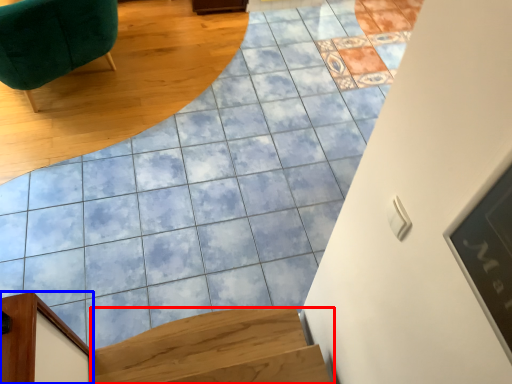
Question: Which object is closer to the camera taking this photo, stairs (highlighted by a red box) or furniture (highlighted by a blue box)?

Choices:
 (A) stairs
 (B) furniture

Answer: (B)